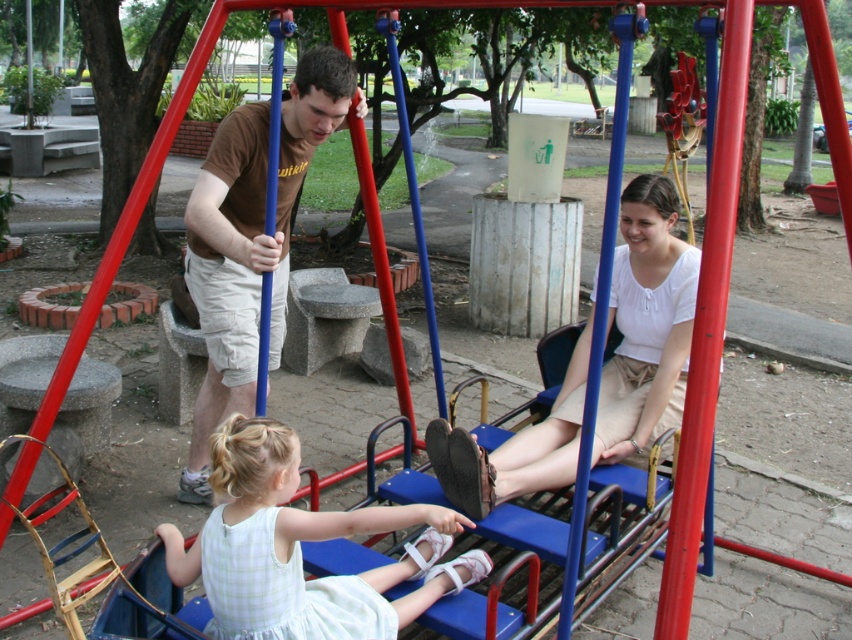
You are at a playground and see two people wearing shirts. One is wearing a white matte shirt at center and the other a brown cotton shirt at center. Which shirt is positioned to the right of the other?

The white matte shirt at center is positioned to the right of the brown cotton shirt at center.

You are a photographer trying to capture a group photo of the white matte shirt at center and brown cotton shirt at center. Since you want to ensure both subjects are visible, which shirt should you position closer to the camera to avoid being obscured?

The white matte shirt at center is wider than the brown cotton shirt at center, so positioning the brown cotton shirt at center closer to the camera would help ensure both are visible without obstruction.

You are a photographer trying to capture a clear photo of both the white satin dress at lower center and the brown cotton shirt at center. Since you want both subjects to be visible, which object should you focus on first to ensure the other remains in the frame?

The white satin dress at lower center is in front of the brown cotton shirt at center, so you should focus on the white satin dress at lower center first to ensure the brown cotton shirt at center stays visible behind it.